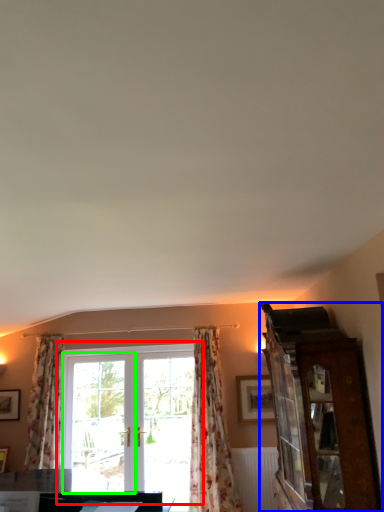
Question: Based on their relative distances, which object is nearer to window (highlighted by a red box)? Choose from cabinetry (highlighted by a blue box) and screen door (highlighted by a green box).

Choices:
 (A) cabinetry
 (B) screen door

Answer: (B)